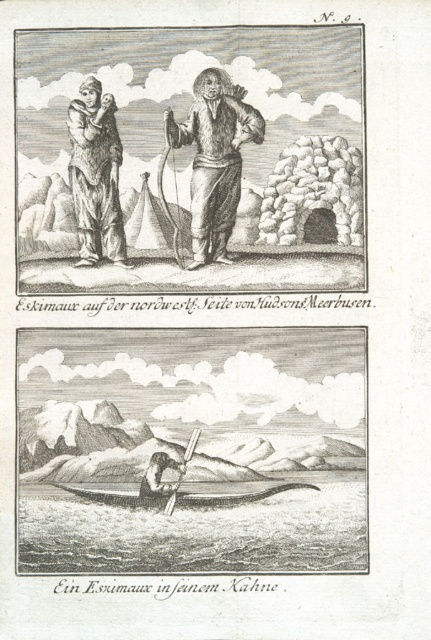
Question: Is brown fur coat at center to the right of brown fur coat at left from the viewer's perspective?

Choices:
 (A) yes
 (B) no

Answer: (A)

Question: Among these objects, which one is nearest to the camera?

Choices:
 (A) black ink drawing of eskimos at center
 (B) smooth skin person at lower center
 (C) smooth wood kayak at center

Answer: (B)

Question: Estimate the real-world distances between objects in this image. Which object is farther from the smooth wood kayak at center?

Choices:
 (A) black ink drawing of eskimos at center
 (B) brown fur coat at left

Answer: (A)

Question: Which of the following is the farthest from the observer?

Choices:
 (A) black fur coat at upper center
 (B) smooth skin person at lower center

Answer: (A)

Question: Can you confirm if brown fur coat at center is thinner than smooth skin person at lower center?

Choices:
 (A) yes
 (B) no

Answer: (B)

Question: Can you confirm if black fur coat at upper center is positioned to the right of brown fur coat at center?

Choices:
 (A) no
 (B) yes

Answer: (A)